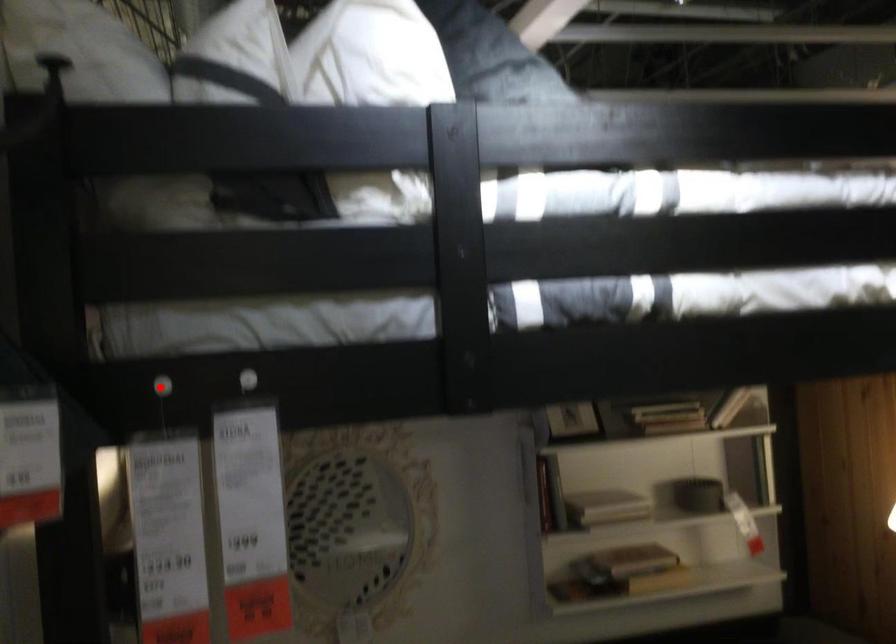
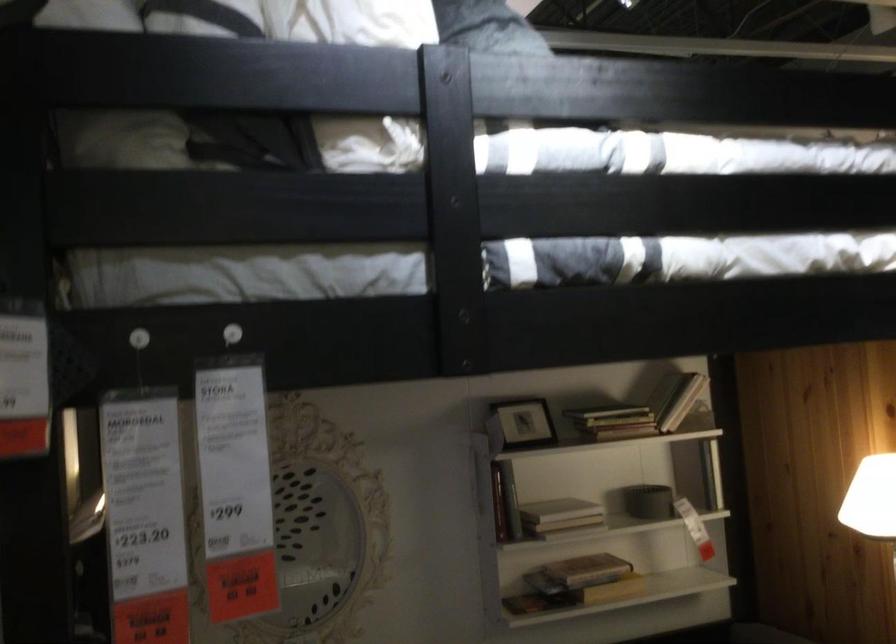
In the second image, find the point that corresponds to the highlighted location in the first image.

(139, 337)